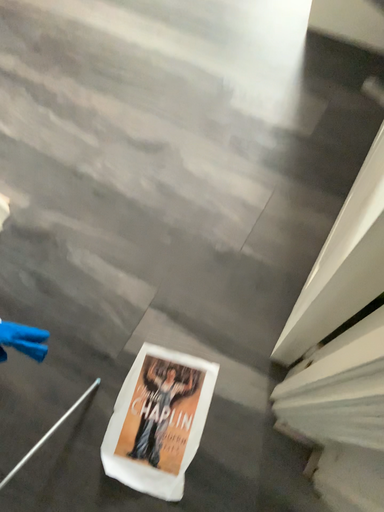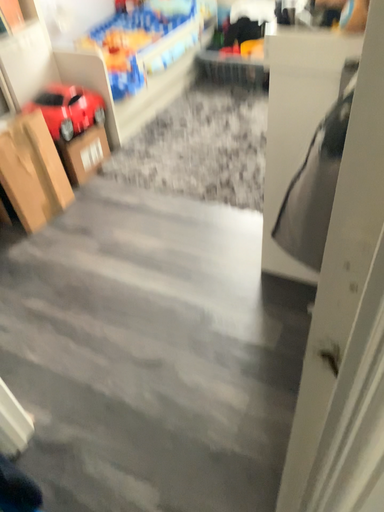
Question: How did the camera likely rotate when shooting the video?

Choices:
 (A) rotated upward
 (B) rotated downward

Answer: (A)